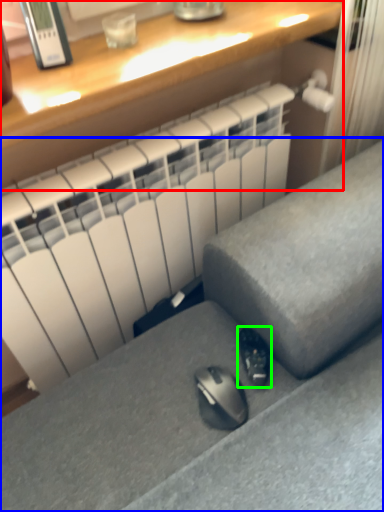
Question: Which is nearer to the desk (highlighted by a red box)? furniture (highlighted by a blue box) or shoe (highlighted by a green box).

Choices:
 (A) furniture
 (B) shoe

Answer: (A)